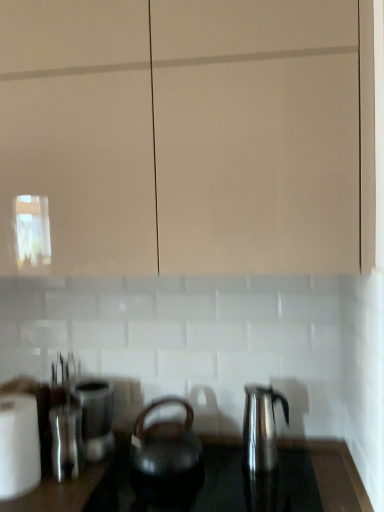
Question: From a real-world perspective, is transparent glass cabinet at upper center physically below shiny black kettle at center?

Choices:
 (A) no
 (B) yes

Answer: (A)

Question: Can you confirm if transparent glass cabinet at upper center is shorter than shiny black kettle at center?

Choices:
 (A) no
 (B) yes

Answer: (A)

Question: Can you confirm if transparent glass cabinet at upper center is wider than shiny black kettle at center?

Choices:
 (A) no
 (B) yes

Answer: (A)

Question: Can you confirm if transparent glass cabinet at upper center is positioned to the left of shiny black kettle at center?

Choices:
 (A) no
 (B) yes

Answer: (B)

Question: From the image's perspective, is transparent glass cabinet at upper center on shiny black kettle at center?

Choices:
 (A) no
 (B) yes

Answer: (B)

Question: Does transparent glass cabinet at upper center lie in front of shiny black kettle at center?

Choices:
 (A) yes
 (B) no

Answer: (A)

Question: From a real-world perspective, is shiny black kettle at center on top of shiny metallic kettle at right, the first kettle positioned from the right?

Choices:
 (A) yes
 (B) no

Answer: (B)

Question: Is shiny black kettle at center facing away from shiny metallic kettle at right, positioned as the second kettle in left-to-right order?

Choices:
 (A) no
 (B) yes

Answer: (A)

Question: Is shiny black kettle at center facing towards shiny metallic kettle at right, the first kettle positioned from the right?

Choices:
 (A) yes
 (B) no

Answer: (B)

Question: Does shiny black kettle at center come behind shiny metallic kettle at right, the first kettle positioned from the right?

Choices:
 (A) no
 (B) yes

Answer: (A)

Question: Is shiny black kettle at center smaller than shiny metallic kettle at right, positioned as the second kettle in left-to-right order?

Choices:
 (A) yes
 (B) no

Answer: (B)

Question: Is shiny black kettle at center next to shiny metallic kettle at right, the first kettle positioned from the right, and touching it?

Choices:
 (A) yes
 (B) no

Answer: (B)

Question: From the image's perspective, is transparent glass cabinet at upper center located beneath black matte kettle at center, the first kettle when ordered from left to right?

Choices:
 (A) yes
 (B) no

Answer: (B)